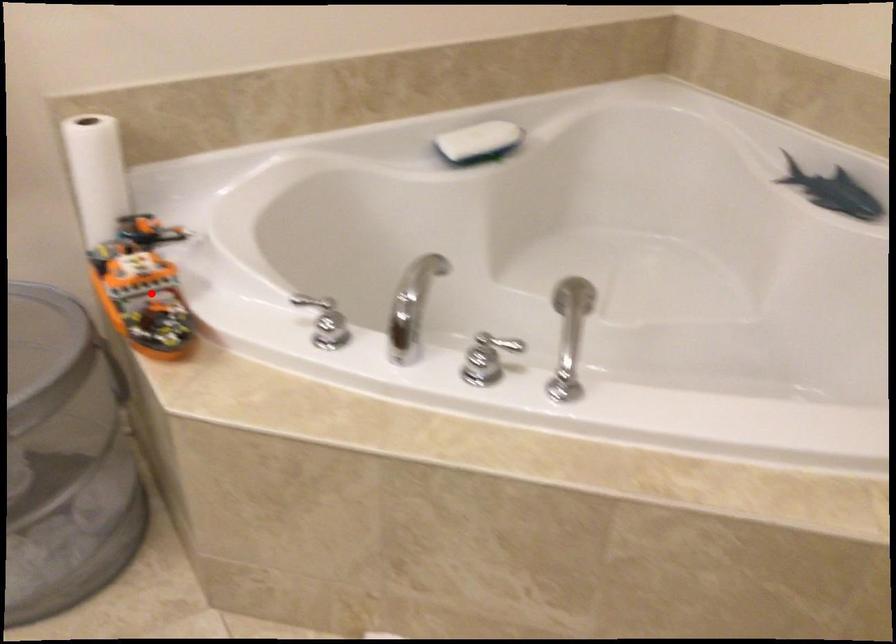
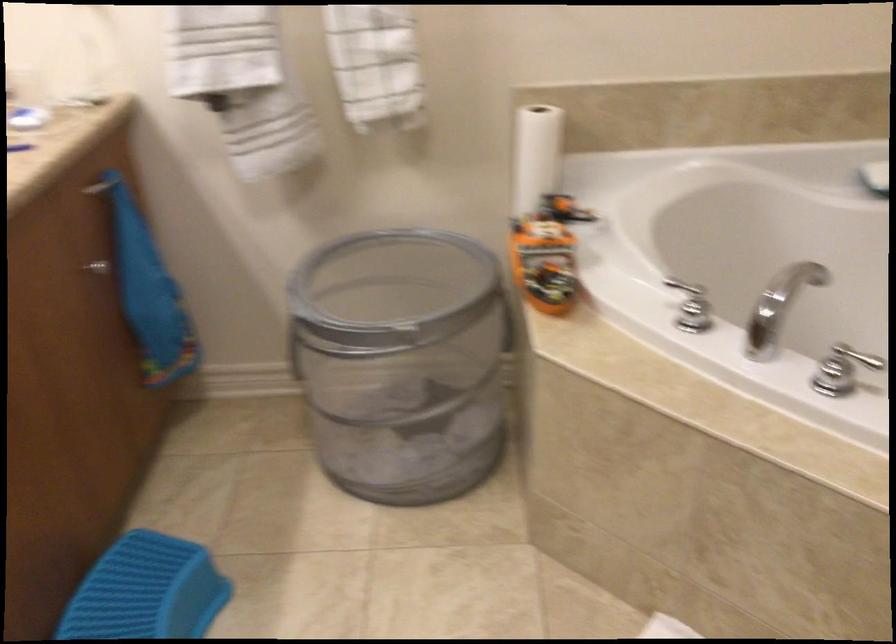
The point at the highlighted location is marked in the first image. Where is the corresponding point in the second image?

(547, 252)